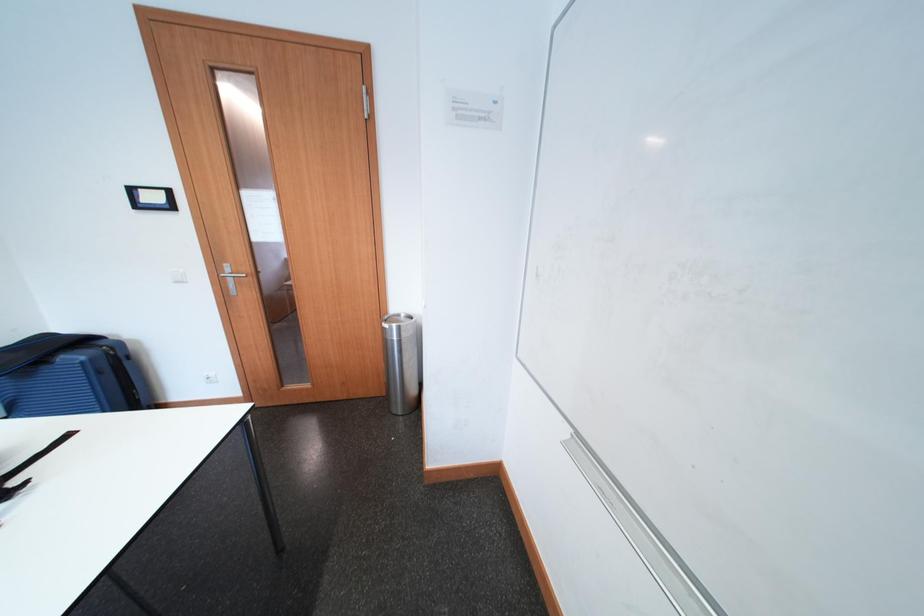
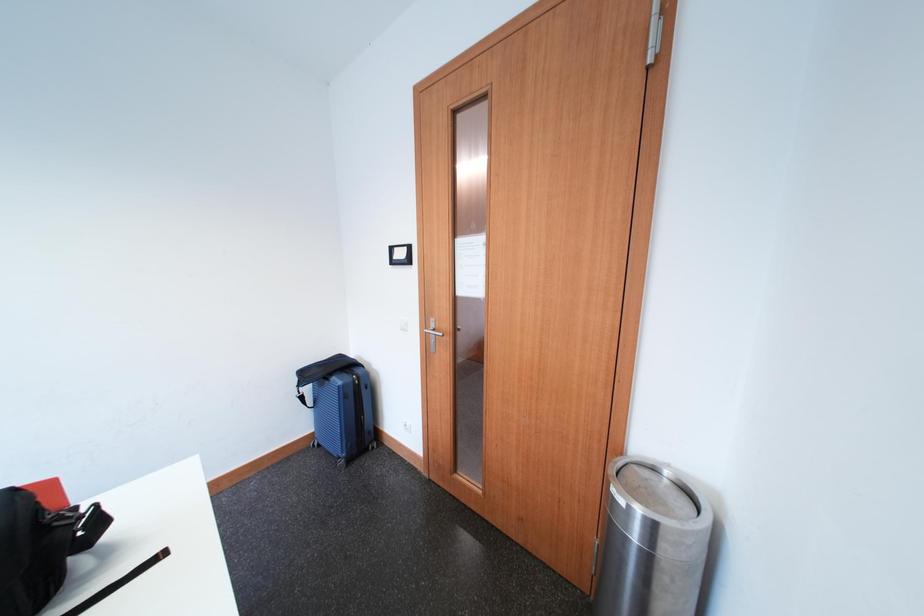
Question: The images are taken continuously from a first-person perspective. In which direction is your viewpoint rotating?

Choices:
 (A) Left
 (B) Right
 (C) Up
 (D) Down

Answer: (A)